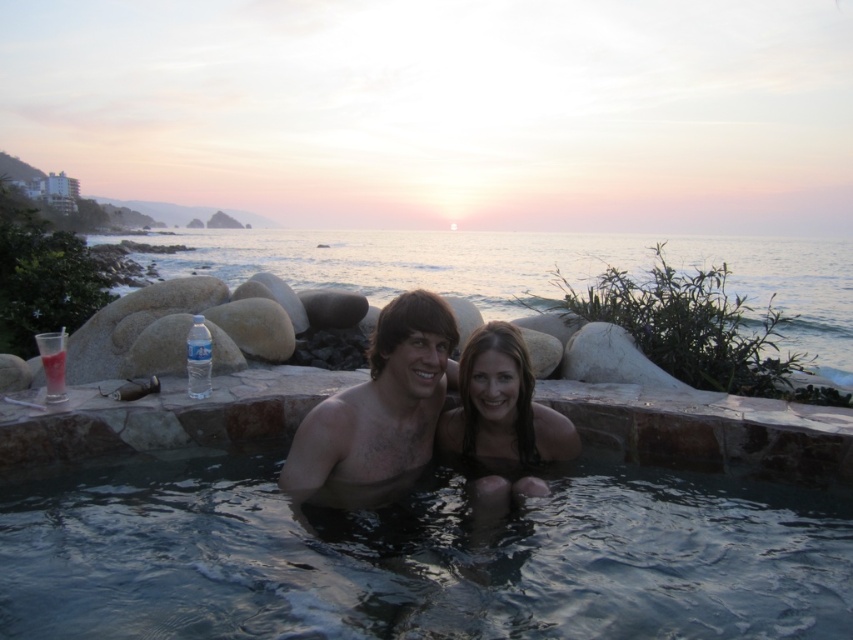
You are standing in front of the hot tub scene and want to take a photo. There are two points marked in the image at coordinates point (708, 561) and point (805, 257). Which point should you focus on first if you want to capture the closest part of the scene to your camera?

Point (708, 561) is closer to the camera than point (805, 257), so you should focus on point (708, 561) first to capture the closest part of the scene.

You are standing in front of the hot tub scene and want to place a small flower pot between the two points marked as point (93, 467) and point (447, 385). Which point should the flower pot be closer to in order to be nearer to the viewer?

The flower pot should be placed closer to point (93, 467) because it is closer to the viewer than point (447, 385).